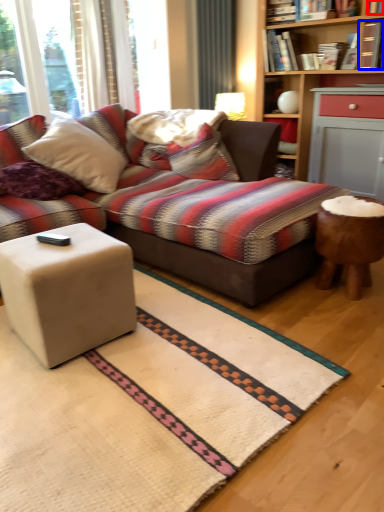
Question: Which object is further to the camera taking this photo, book (highlighted by a red box) or book (highlighted by a blue box)?

Choices:
 (A) book
 (B) book

Answer: (B)